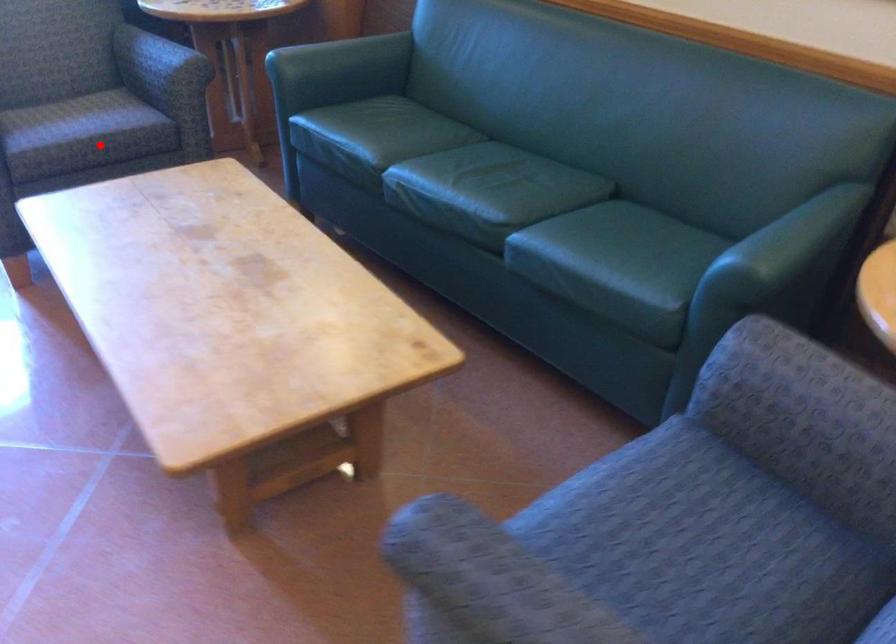
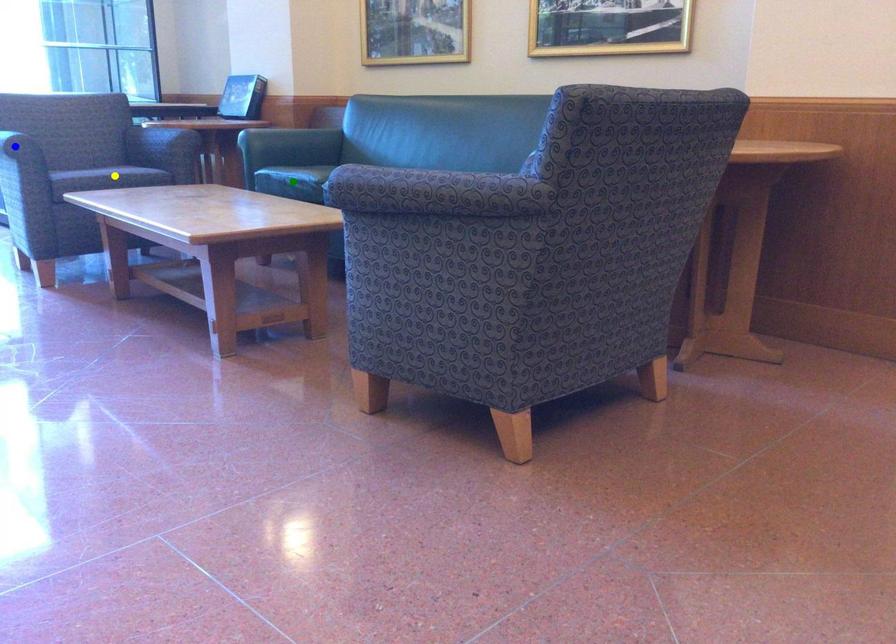
Question: I am providing you with two images of the same scene from different viewpoints. A red point is marked on the first image. You are given multiple points on the second image. In image 2, which mark is for the same physical point as the one in image 1?

Choices:
 (A) yellow point
 (B) blue point
 (C) green point

Answer: (A)